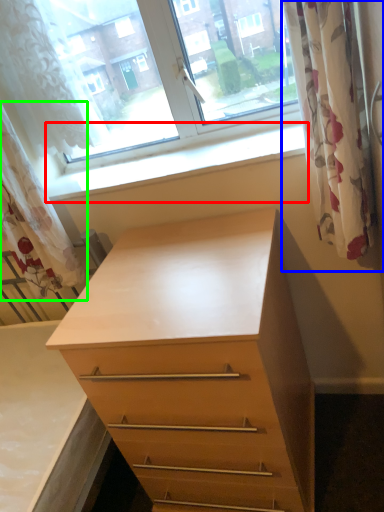
Question: Estimate the real-world distances between objects in this image. Which object is farther from window sill (highlighted by a red box), curtain (highlighted by a blue box) or curtain (highlighted by a green box)?

Choices:
 (A) curtain
 (B) curtain

Answer: (A)